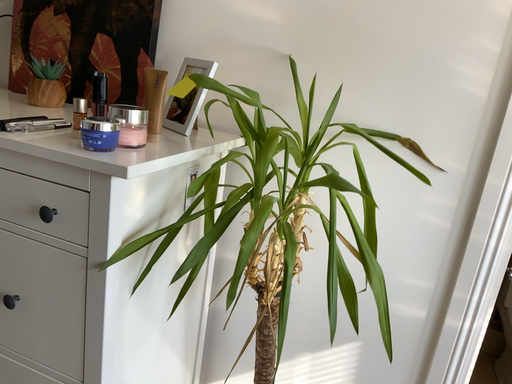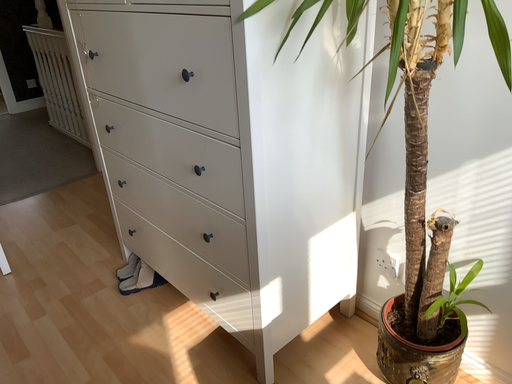
Question: Which way did the camera rotate in the video?

Choices:
 (A) rotated right
 (B) rotated left

Answer: (B)